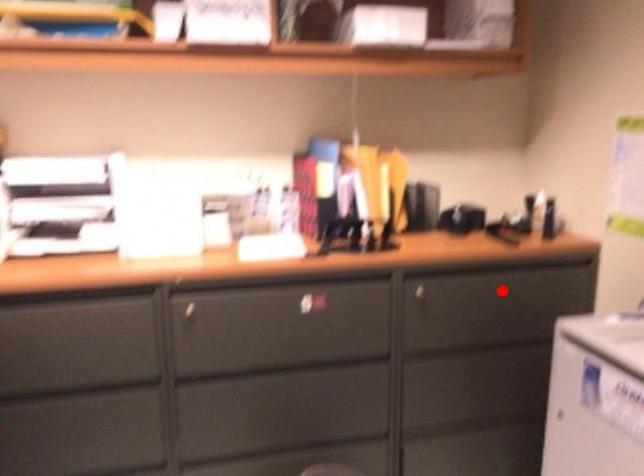
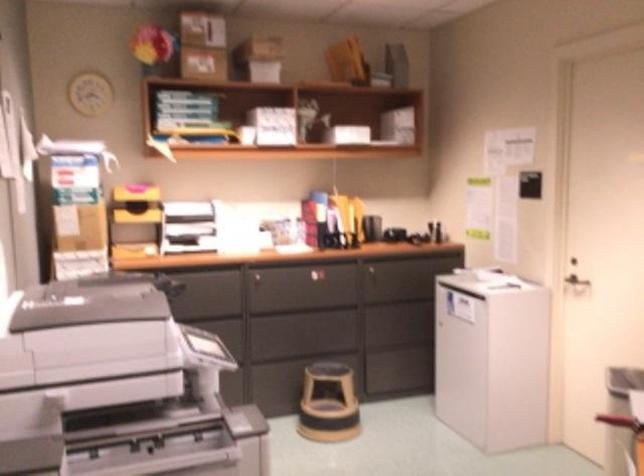
Question: I am providing you with two images of the same scene from different viewpoints. A red point is shown in image1. For the corresponding object point in image2, is it positioned nearer or farther from the camera?

Choices:
 (A) Nearer
 (B) Farther

Answer: (B)